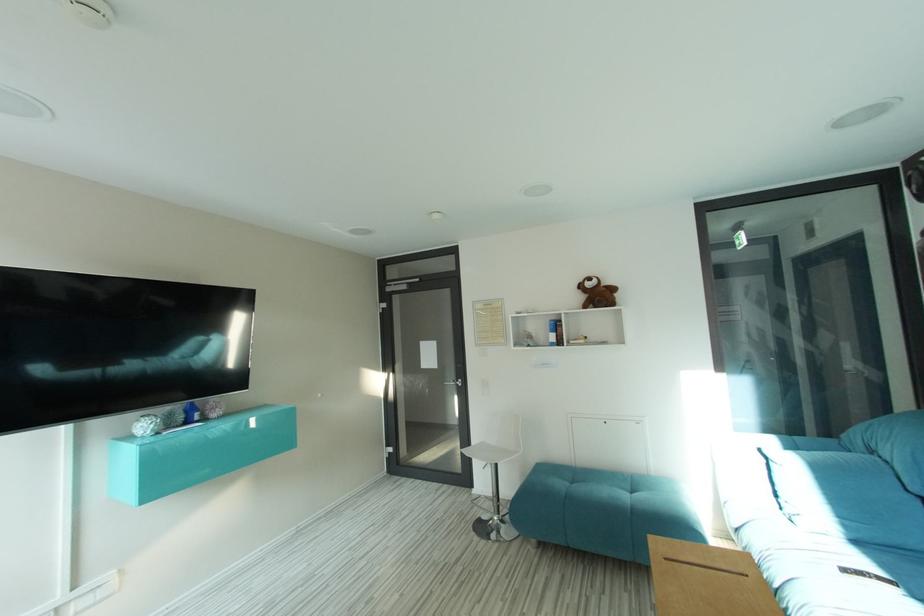
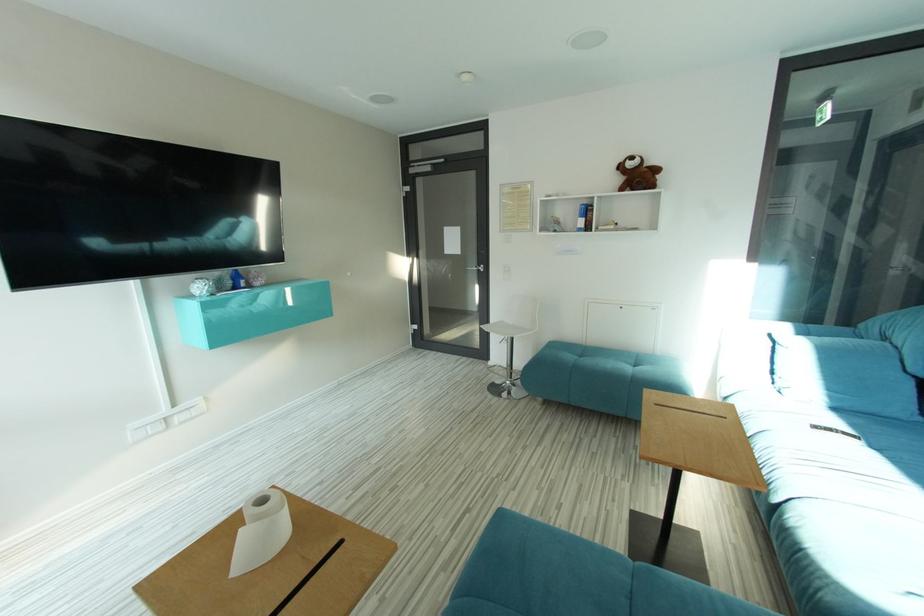
Question: The images are taken continuously from a first-person perspective. In which direction is your viewpoint rotating?

Choices:
 (A) Left
 (B) Right
 (C) Up
 (D) Down

Answer: (D)